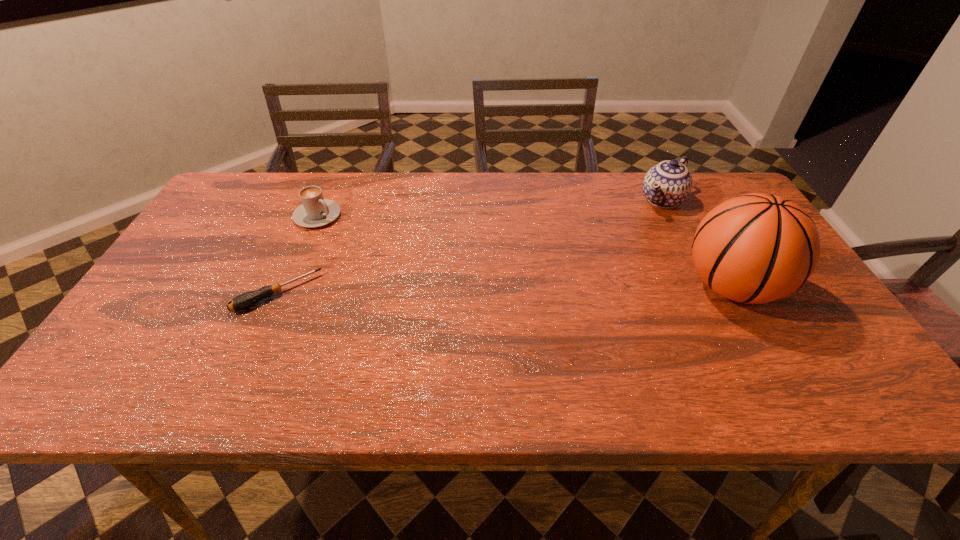
At what (x,y) coordinates should I click in order to perform the action: click on free space on the desktop that is between the shortest object and the tallest object and is positioned at the spout of the chinaware. Please return your answer as a coordinate pair (x, y). Looking at the image, I should click on (567, 289).

At what (x,y) coordinates should I click in order to perform the action: click on free spot on the desktop that is between the screwdriver and the tallest object and is positioned to the right of the cappuccino. Please return your answer as a coordinate pair (x, y). Looking at the image, I should click on (454, 291).